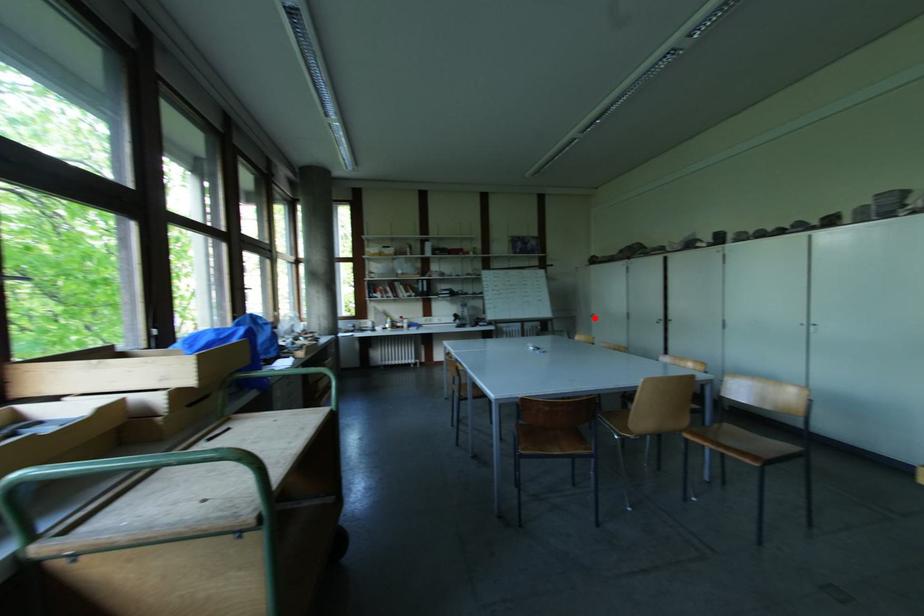
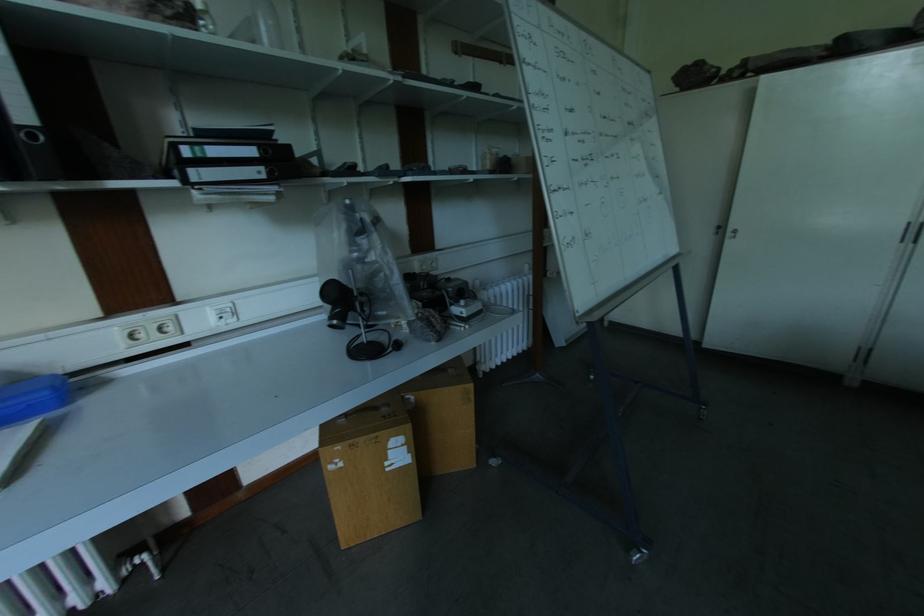
Find the pixel in the second image that matches the highlighted location in the first image.

(737, 238)